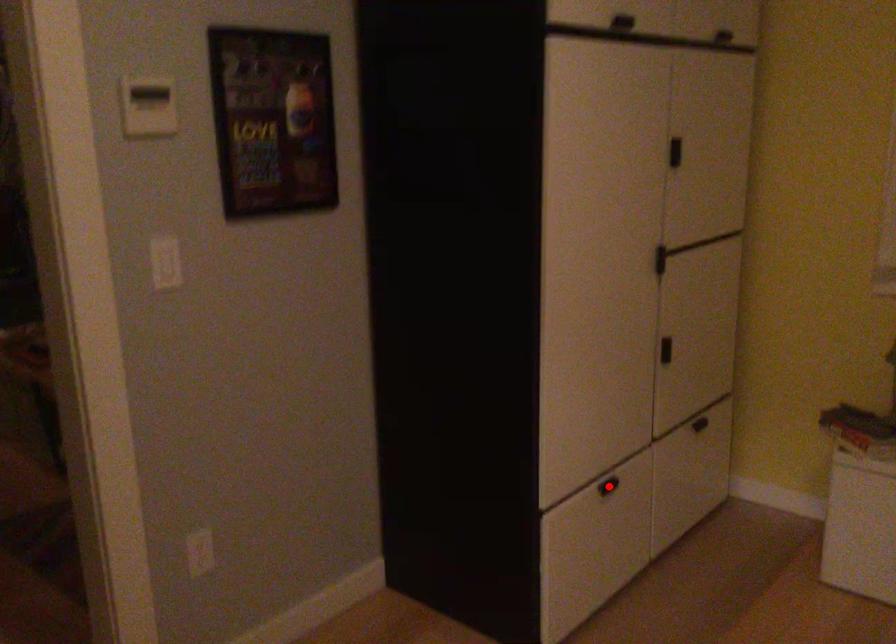
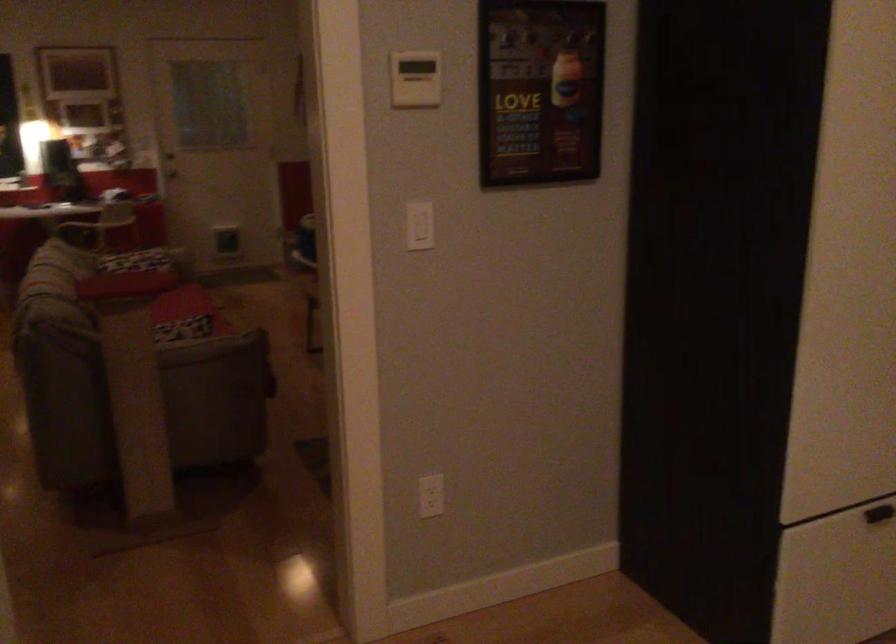
Question: I am providing you with two images of the same scene from different viewpoints. In image1, a red point is highlighted. Considering the same 3D point in image2, which of the following is correct?

Choices:
 (A) It is closer
 (B) It is farther

Answer: (A)